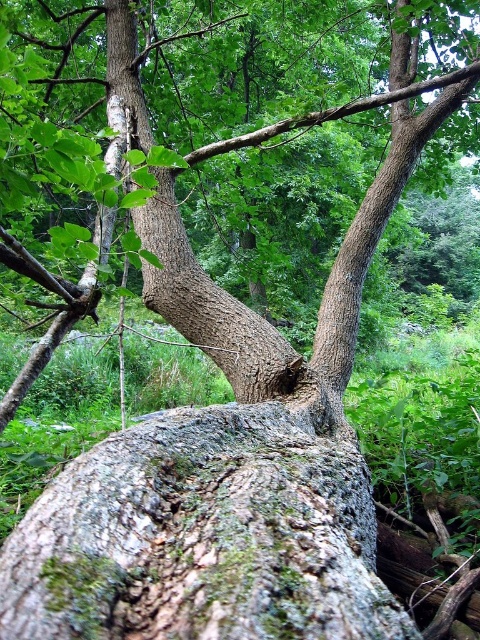
You are a hiker who wants to place a small flag on the highest point between the green mossy rock at center and the rough bark tree at center. Which object should you choose?

The rough bark tree at center is taller than the green mossy rock at center, so you should place the flag on the rough bark tree at center.

You are a hiker who wants to place a small backpack between the green mossy rock at center and the rough bark tree at center. Which object should you place it closer to in order to have the backpack visible to someone approaching from the front?

The green mossy rock at center is closer to the viewer than the rough bark tree at center, so placing the backpack closer to the green mossy rock at center will make it more visible to someone approaching from the front.